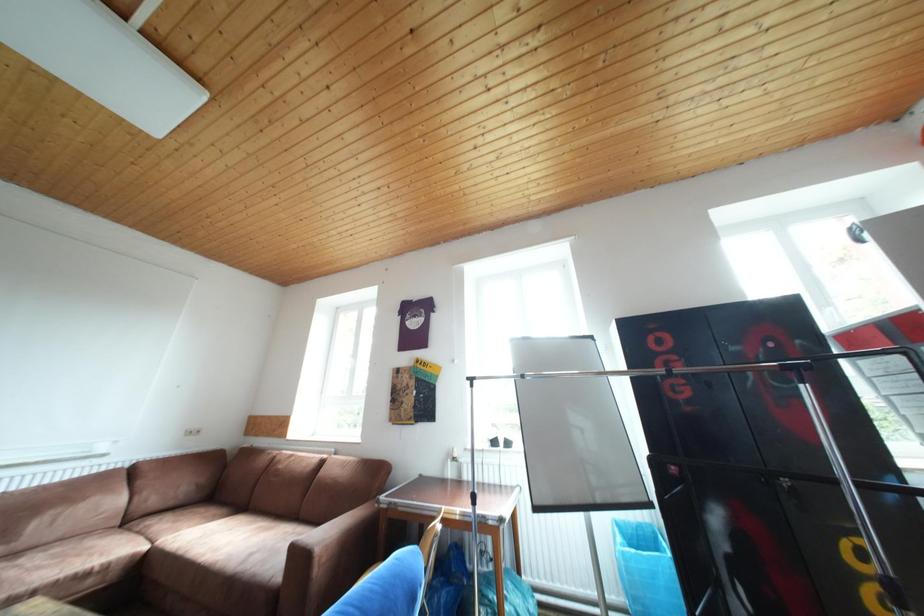
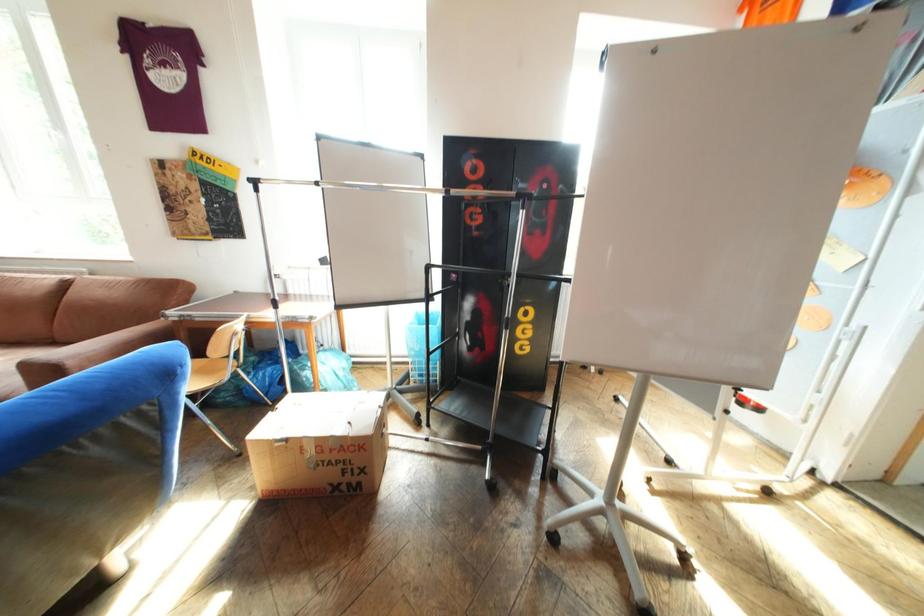
The images are taken continuously from a first-person perspective. In which direction is your viewpoint rotating?

The camera's rotation is toward right-down.